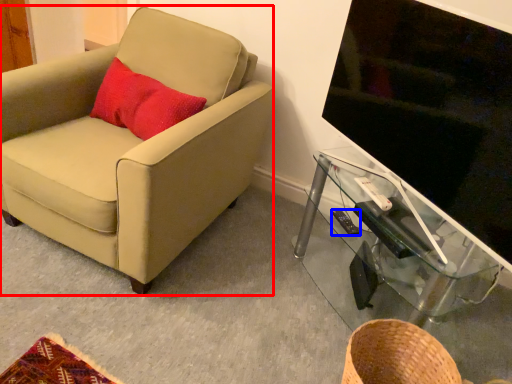
Question: Which point is further to the camera, chair (highlighted by a red box) or remote control (highlighted by a blue box)?

Choices:
 (A) chair
 (B) remote control

Answer: (B)